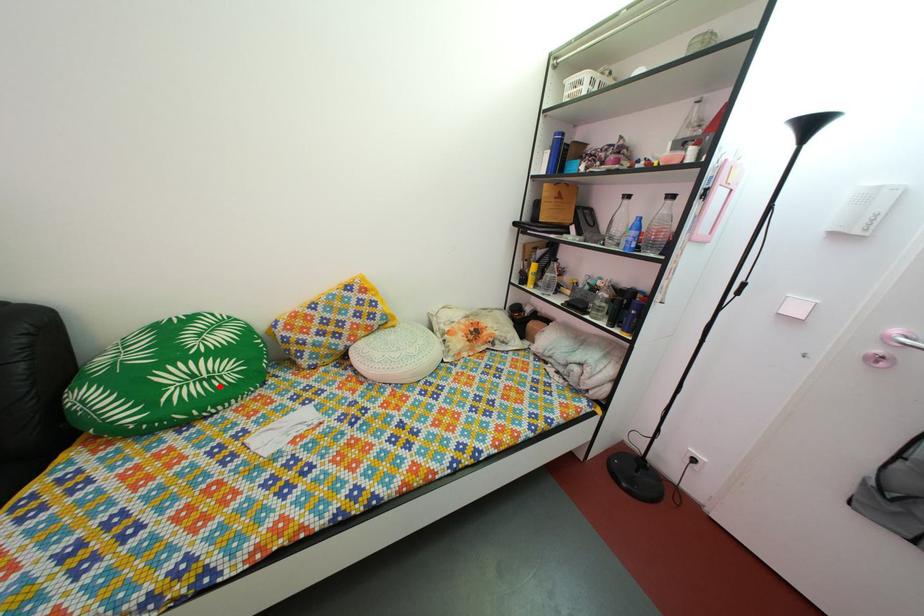
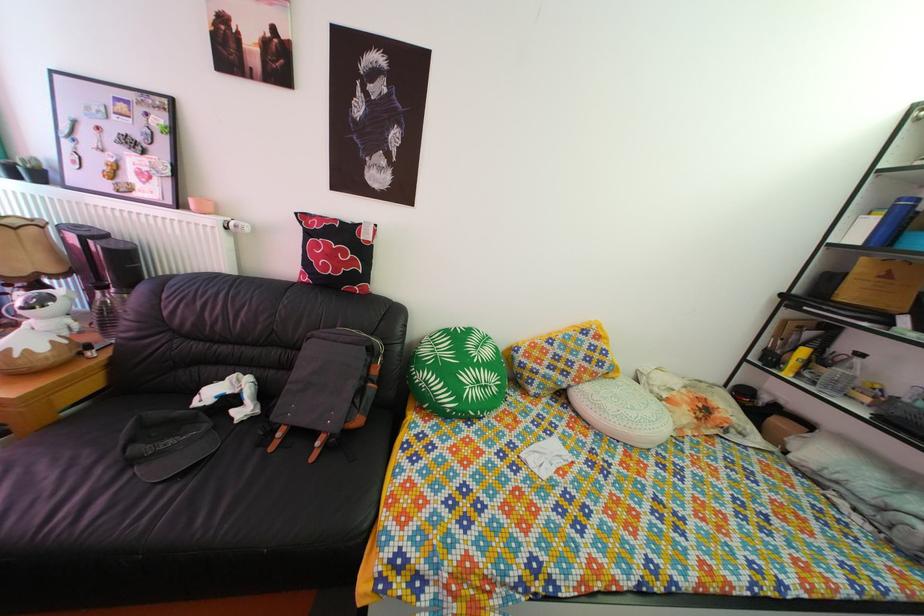
The point at the highlighted location is marked in the first image. Where is the corresponding point in the second image?

(494, 395)